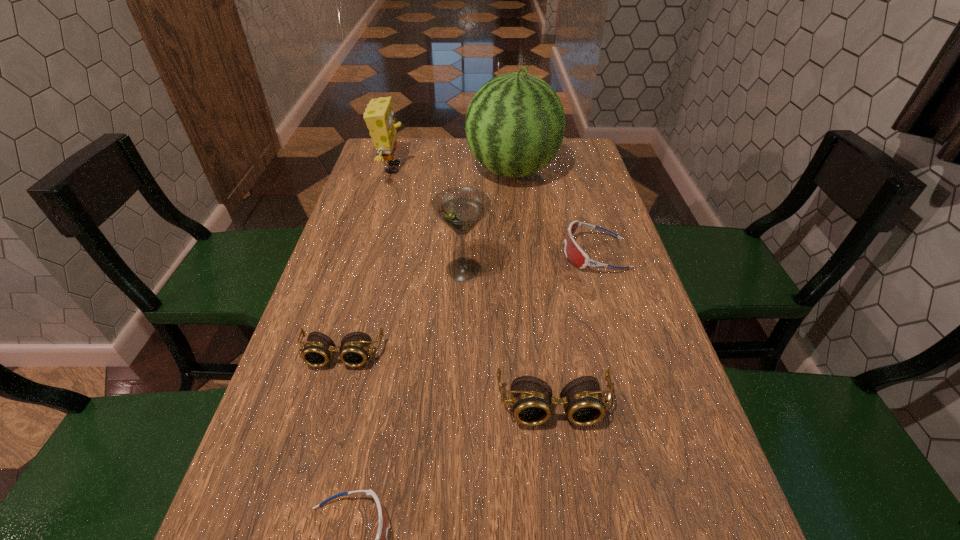
You are a GUI agent. You are given a task and a screenshot of the screen. Output one action in this format:
    pyautogui.click(x=<x>, y=<y>)
    Task: Click on the free space located on the left of the watermelon
    
    Given the screenshot: What is the action you would take?
    pyautogui.click(x=444, y=171)

Where is `vacant point located 0.220m on the back of the martini`? The height and width of the screenshot is (540, 960). vacant point located 0.220m on the back of the martini is located at coordinates (467, 205).

This screenshot has height=540, width=960. What are the coordinates of `free spot located 0.240m on the face of the yellow sponge` in the screenshot? It's located at (481, 168).

What are the coordinates of `vacant space situated through the lenses of the bigger brown goggles` in the screenshot? It's located at (570, 531).

Locate an element on the screen. free spot located 0.380m on the front-facing side of the farthest goggles is located at coordinates (414, 253).

The width and height of the screenshot is (960, 540). Find the location of `free location located 0.240m on the front-facing side of the farthest goggles`. free location located 0.240m on the front-facing side of the farthest goggles is located at coordinates (468, 253).

Find the location of a particular element. The width and height of the screenshot is (960, 540). free location located 0.170m on the front-facing side of the farthest goggles is located at coordinates (495, 253).

The height and width of the screenshot is (540, 960). I want to click on vacant space positioned through the lenses of the farther brown goggles, so click(314, 456).

Locate an element on the screen. The width and height of the screenshot is (960, 540). watermelon that is at the far edge is located at coordinates (515, 124).

The image size is (960, 540). I want to click on sponge that is at the far edge, so click(379, 117).